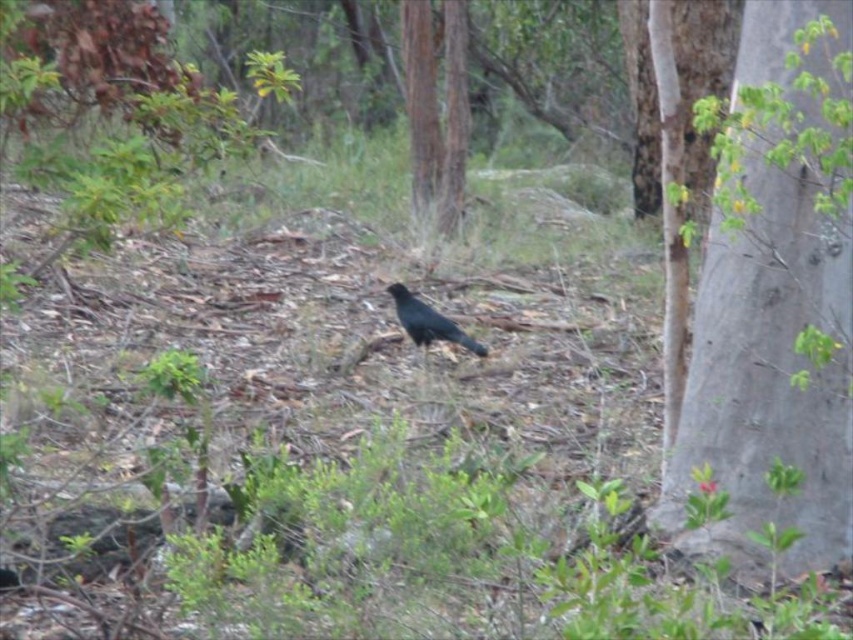
Who is positioned more to the left, gray rough bark tree at right or shiny black bird at center?

shiny black bird at center is more to the left.

Who is positioned more to the right, gray rough bark tree at right or shiny black bird at center?

gray rough bark tree at right

Is point (809, 52) positioned after point (434, 320)?

No, it is in front of (434, 320).

This screenshot has width=853, height=640. What are the coordinates of `gray rough bark tree at right` in the screenshot? It's located at (767, 376).

Is gray rough bark tree at right shorter than smooth bark tree at center?

Incorrect, gray rough bark tree at right's height does not fall short of smooth bark tree at center's.

Who is positioned more to the right, gray rough bark tree at right or smooth bark tree at center?

gray rough bark tree at right

Which is behind, point (772, 259) or point (460, 211)?

Positioned behind is point (460, 211).

This screenshot has height=640, width=853. Find the location of `gray rough bark tree at right`. gray rough bark tree at right is located at coordinates (767, 376).

Does smooth bark tree at center appear on the left side of shiny black bird at center?

Correct, you'll find smooth bark tree at center to the left of shiny black bird at center.

Consider the image. Who is more distant from viewer, (416, 49) or (433, 317)?

Positioned behind is point (416, 49).

You are a GUI agent. You are given a task and a screenshot of the screen. Output one action in this format:
    pyautogui.click(x=<x>, y=<y>)
    Task: Click on the smooth bark tree at center
    The height and width of the screenshot is (640, 853).
    Given the screenshot: What is the action you would take?
    pyautogui.click(x=436, y=108)